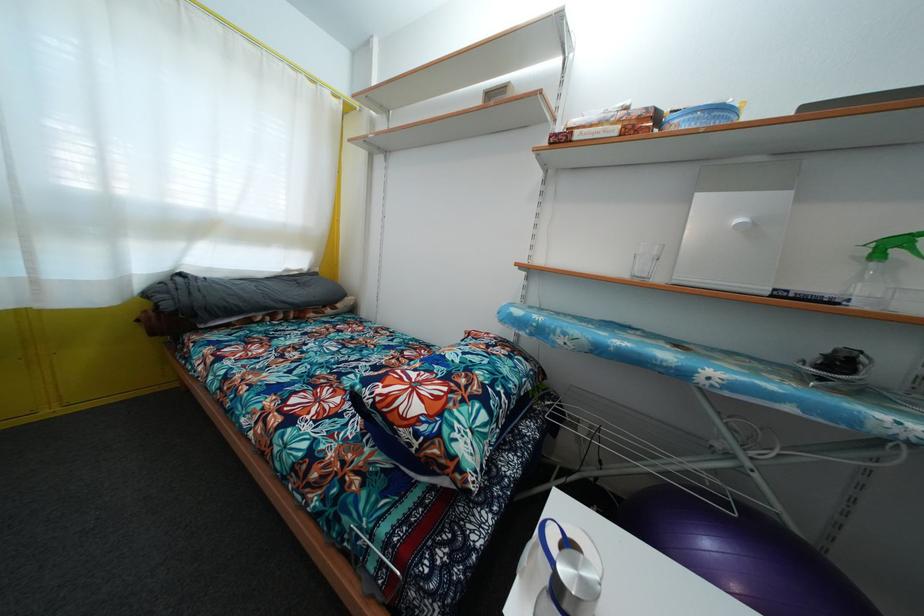
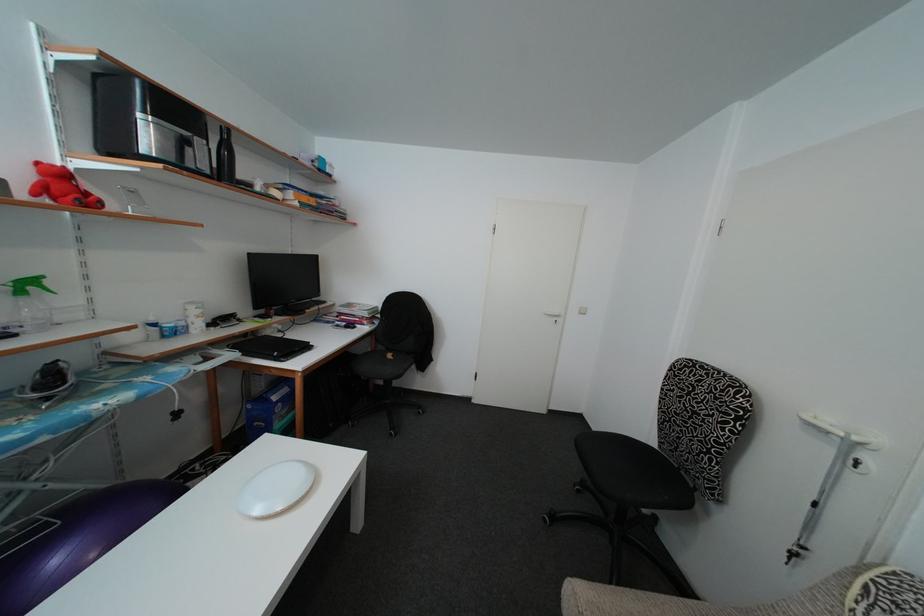
First-person continuous shooting, in which direction is the camera rotating?

The rotation direction of the camera is right-down.